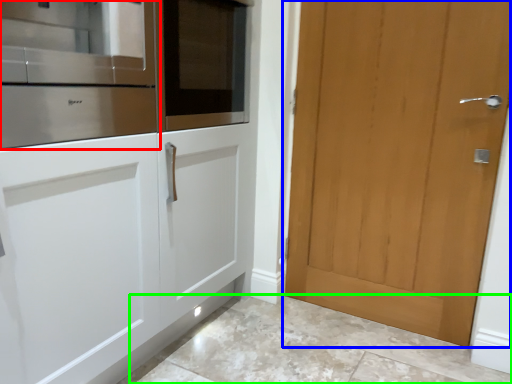
Question: Which object is the farthest from cabinetry (highlighted by a red box)? Choose among these: door (highlighted by a blue box) or granite (highlighted by a green box).

Choices:
 (A) door
 (B) granite

Answer: (B)